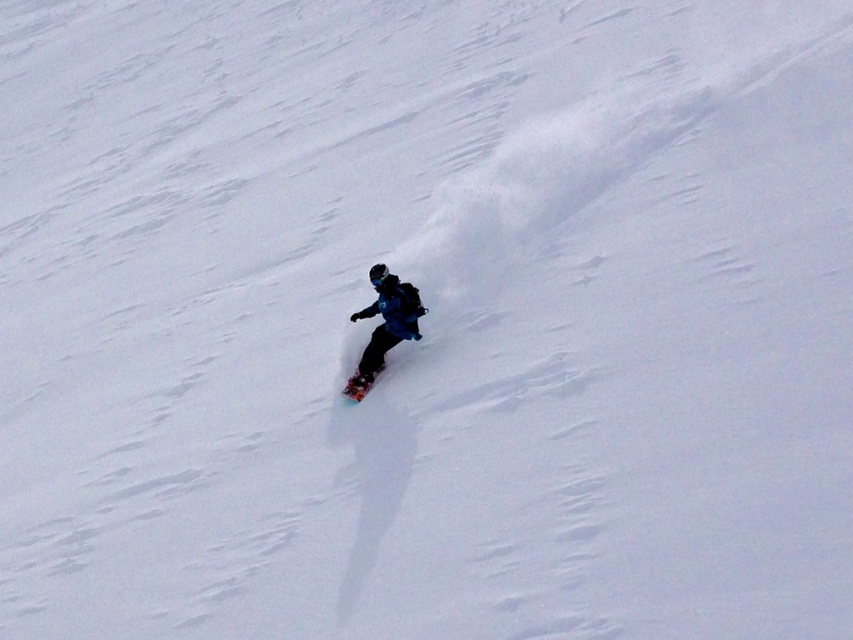
Who is positioned more to the left, blue matte snowboarder at center or shiny black snowboard at center?

shiny black snowboard at center

Which of these two, blue matte snowboarder at center or shiny black snowboard at center, stands taller?

With more height is blue matte snowboarder at center.

This screenshot has width=853, height=640. In order to click on blue matte snowboarder at center in this screenshot , I will do `click(386, 321)`.

Locate an element on the screen. The image size is (853, 640). blue matte snowboarder at center is located at coordinates (386, 321).